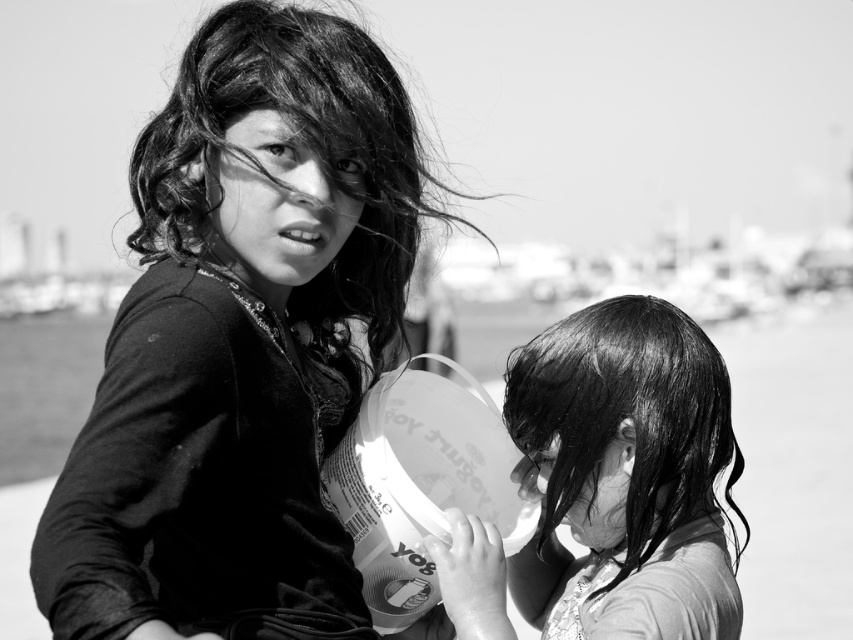
Question: Can you confirm if velvet black shirt at center is positioned below wet hair at center?

Choices:
 (A) yes
 (B) no

Answer: (B)

Question: Which point is closer to the camera?

Choices:
 (A) (351, 632)
 (B) (666, 472)

Answer: (B)

Question: Which of the following is the farthest from the observer?

Choices:
 (A) (318, 515)
 (B) (479, 580)

Answer: (A)

Question: Can you confirm if velvet black shirt at center is bigger than wet hair at center?

Choices:
 (A) no
 (B) yes

Answer: (B)

Question: Is velvet black shirt at center behind wet hair at center?

Choices:
 (A) yes
 (B) no

Answer: (B)